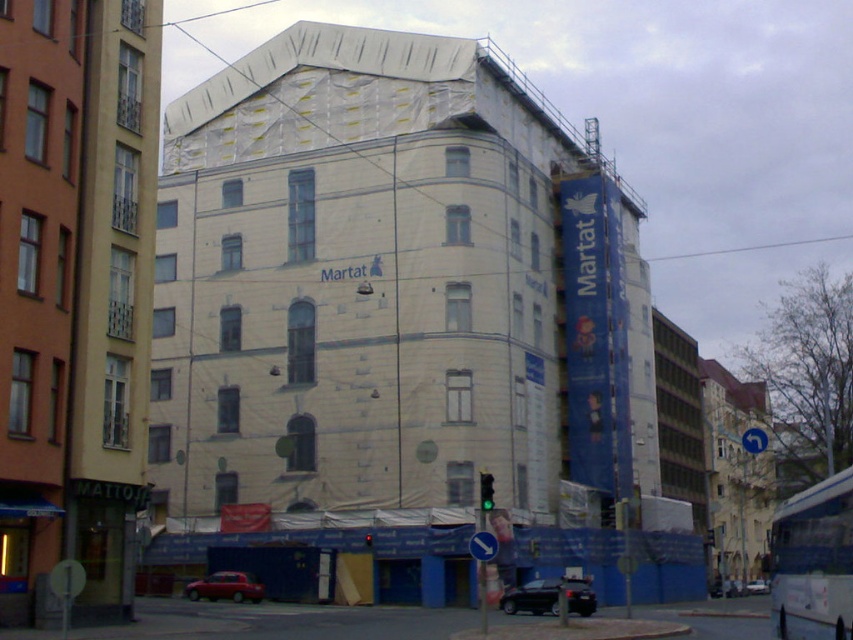
You are a pedestrian standing on the sidewalk near the shiny red car at lower left and the metallic silver car at center. Which car is closer to you?

The shiny red car at lower left is closer to you than the metallic silver car at center.

You are a delivery driver who needs to park your truck, which is 5 meters long, between the metallic silver car at center and the silver metallic sedan at center. Is there enough space between them for your truck?

The distance between the metallic silver car at center and the silver metallic sedan at center is 4.29 meters. Since your truck is 5 meters long, there isn not enough space between them to park your truck.

You are a delivery person who needs to park your van next to the black glossy car at center and the shiny red car at lower left. Which of the two cars should you park next to if you need more space for your van?

The black glossy car at center is bigger than the shiny red car at lower left, so you should park next to the shiny red car at lower left to have more space available.